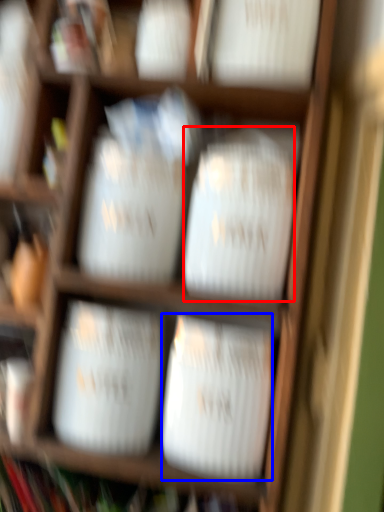
Question: Which point is closer to the camera, wide (highlighted by a red box) or wide (highlighted by a blue box)?

Choices:
 (A) wide
 (B) wide

Answer: (A)